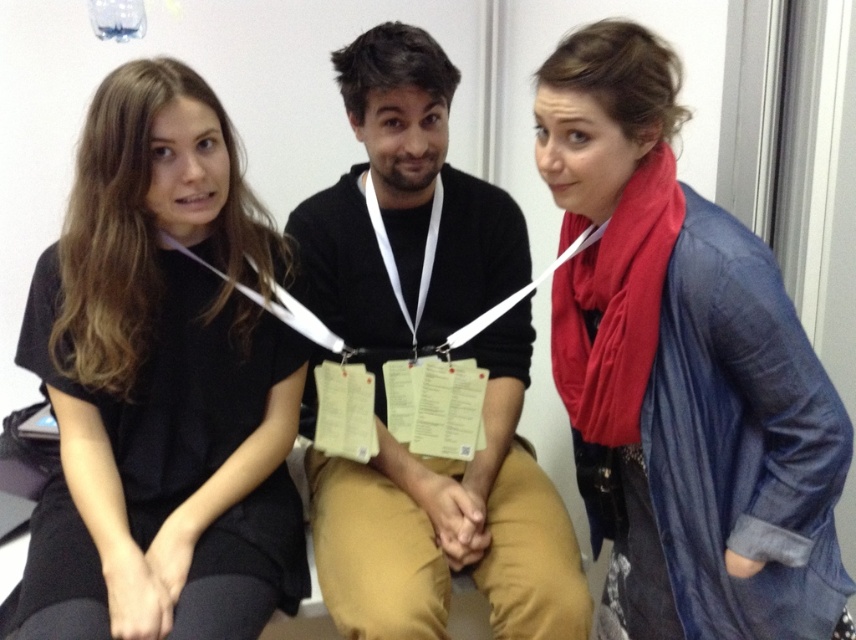
Based on the photo, you are standing in the room where the three people are seated. You want to pick up an object located at point (129, 198). Can you reach it without moving your feet?

The distance of point (129, 198) from camera is 4.04 feet, so if you are standing at the camera position, you can reach it without moving your feet as 4.04 feet is within typical arm reach distance.

You are organizing a photo shoot and need to ensure that all participants are visible in the frame. Given that the black matte shirt at left and the black cotton hoodie at center are both in the shot, which one should you adjust to make sure they are both fully visible?

The black matte shirt at left occupies less space than the black cotton hoodie at center. To ensure both are fully visible, you should adjust the angle or zoom so that the larger black cotton hoodie at center fits without cropping, which will automatically accommodate the smaller black matte shirt at left.

You are standing in the room and want to hand a document to the person wearing the black matte shirt at left. Based on their position, where should you approach from?

The black matte shirt at left is located at point (161, 385), so you should approach from the right side to reach them comfortably.